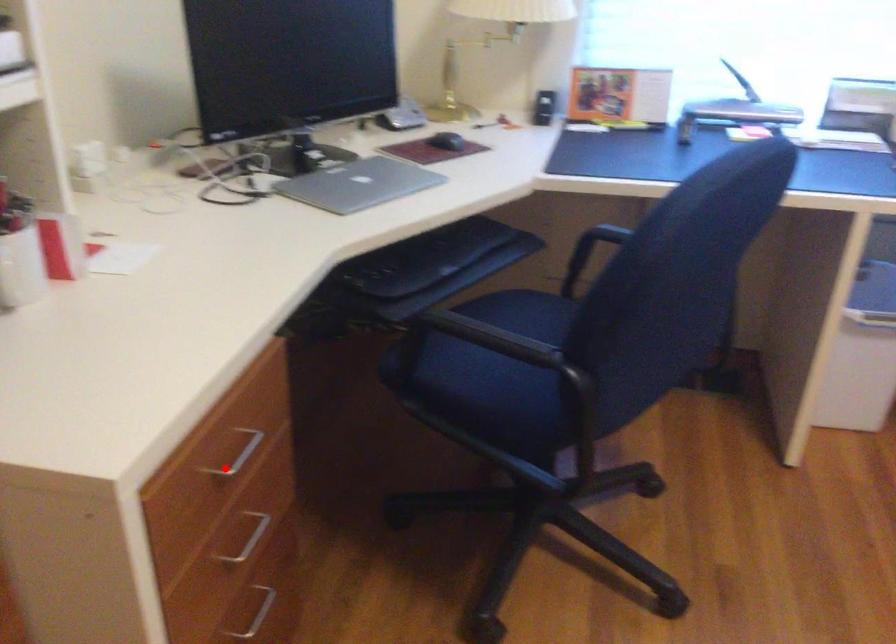
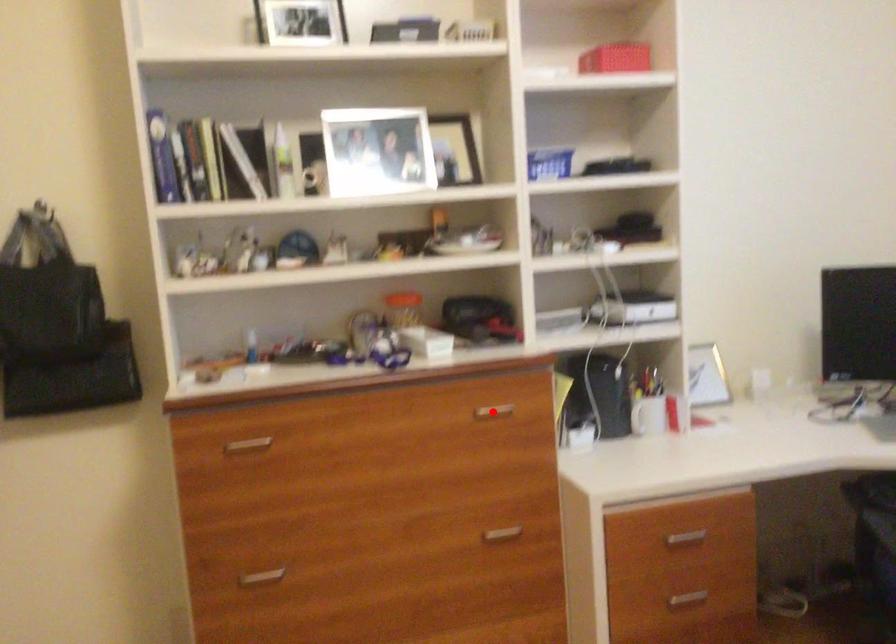
In the scene shown: I am providing you with two images of the same scene from different viewpoints. A red point is marked on the first image and another point is marked on the second image. Are the points marked in image1 and image2 representing the same 3D position?

No